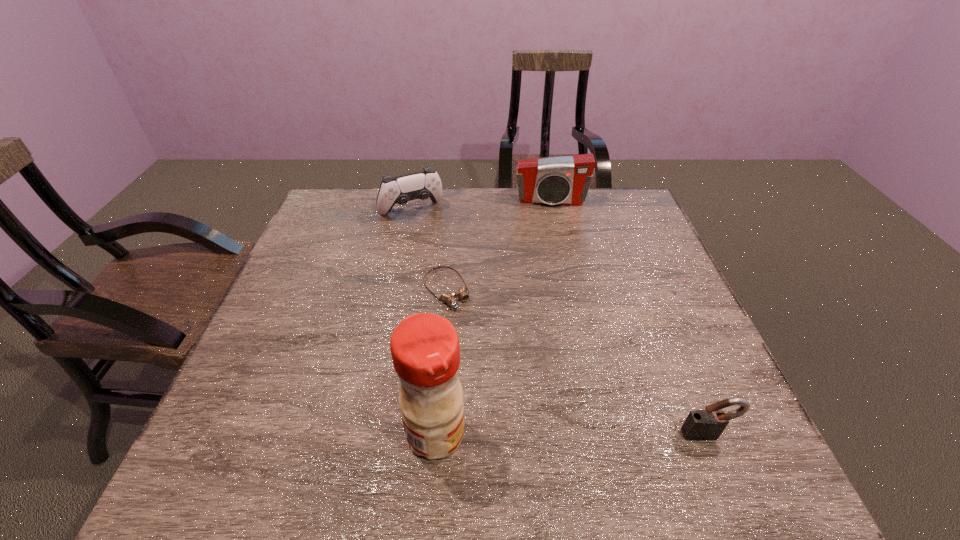
Identify the location of free spot located 0.230m on the front lenses and sides of the third nearest object. The width and height of the screenshot is (960, 540). (509, 376).

Locate an element on the screen. vacant region located on the front-facing side of the control is located at coordinates (471, 301).

At what (x,y) coordinates should I click in order to perform the action: click on vacant region located on the front-facing side of the control. Please return your answer as a coordinate pair (x, y). Looking at the image, I should click on (427, 230).

The image size is (960, 540). Identify the location of free spot located on the front-facing side of the control. (433, 239).

Where is `free space located on the front-facing side of the fourth object from left to right`? This screenshot has width=960, height=540. free space located on the front-facing side of the fourth object from left to right is located at coordinates (556, 266).

Locate an element on the screen. The image size is (960, 540). vacant position located on the front-facing side of the fourth object from left to right is located at coordinates (553, 239).

Identify the location of free space located on the front-facing side of the fourth object from left to right. Image resolution: width=960 pixels, height=540 pixels. (551, 222).

Identify the location of control located in the far edge section of the desktop. This screenshot has height=540, width=960. point(420,185).

Locate an element on the screen. The width and height of the screenshot is (960, 540). camera at the far edge is located at coordinates (563, 180).

At what (x,y) coordinates should I click in order to perform the action: click on condiment at the near edge. Please return your answer as a coordinate pair (x, y). This screenshot has height=540, width=960. Looking at the image, I should click on coord(425,350).